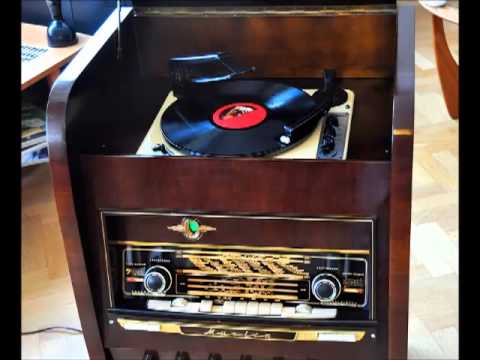
Where is `floor to left of record player`? The height and width of the screenshot is (360, 480). floor to left of record player is located at coordinates 38,268.